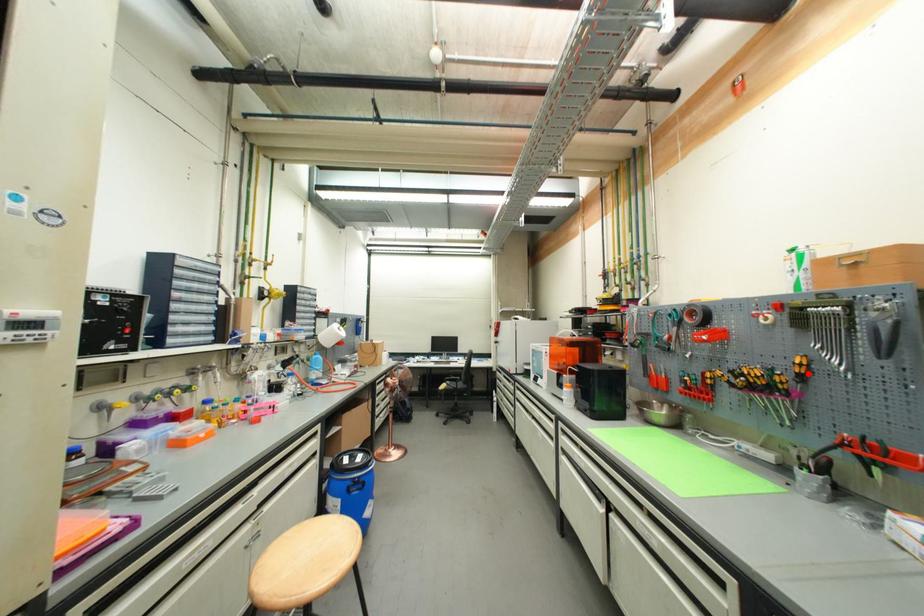
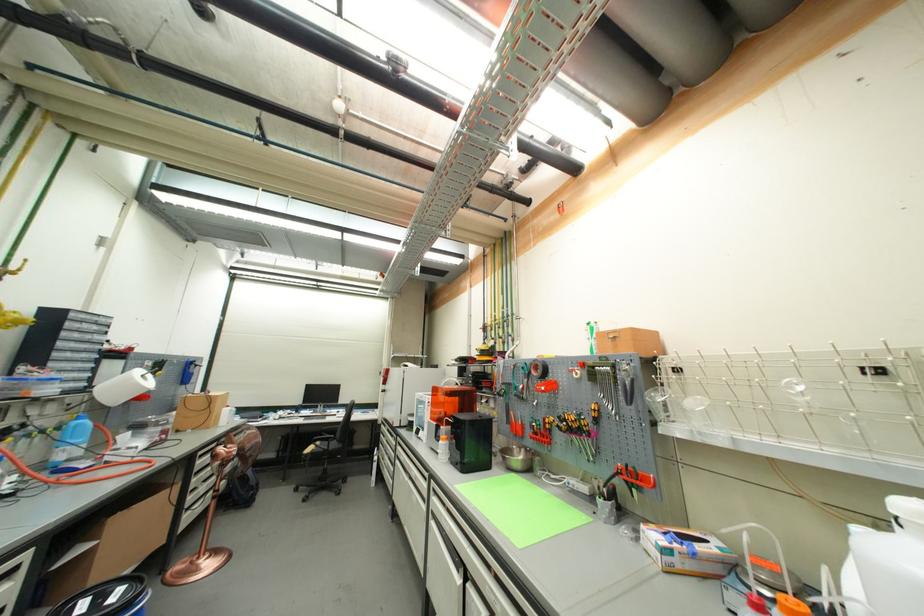
Find the pixel in the second image that matches the highlighted location in the first image.

(602, 418)